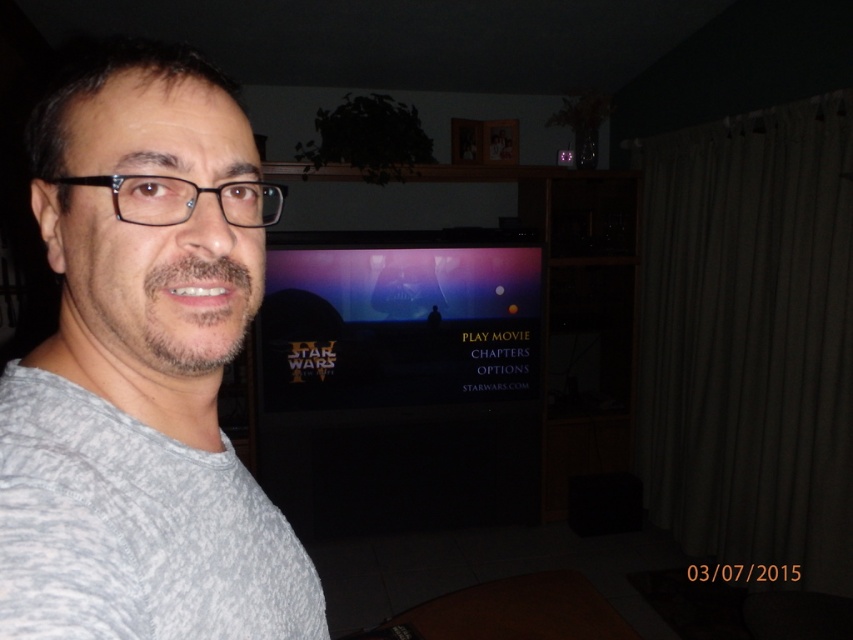
Looking at this image, who is positioned more to the left, gray matte shirt at left or gray textured shirt at left?

gray matte shirt at left is more to the left.

Who is higher up, gray matte shirt at left or gray textured shirt at left?

gray matte shirt at left is above.

The width and height of the screenshot is (853, 640). What do you see at coordinates (143, 369) in the screenshot?
I see `gray matte shirt at left` at bounding box center [143, 369].

This screenshot has height=640, width=853. I want to click on gray matte shirt at left, so click(x=143, y=369).

The image size is (853, 640). Describe the element at coordinates (143, 369) in the screenshot. I see `gray matte shirt at left` at that location.

I want to click on gray matte shirt at left, so click(x=143, y=369).

Does black glossy tv at center appear under gray textured shirt at left?

Incorrect, black glossy tv at center is not positioned below gray textured shirt at left.

Is black glossy tv at center thinner than gray textured shirt at left?

Incorrect, black glossy tv at center's width is not less than gray textured shirt at left's.

You are a GUI agent. You are given a task and a screenshot of the screen. Output one action in this format:
    pyautogui.click(x=<x>, y=<y>)
    Task: Click on the black glossy tv at center
    This screenshot has height=640, width=853.
    Given the screenshot: What is the action you would take?
    pyautogui.click(x=450, y=360)

This screenshot has height=640, width=853. Identify the location of black glossy tv at center. (450, 360).